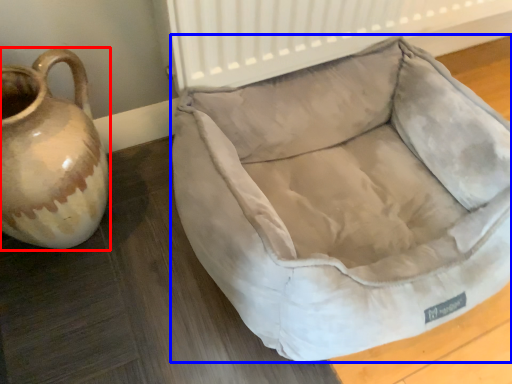
Question: Which object is further to the camera taking this photo, jug (highlighted by a red box) or dog bed (highlighted by a blue box)?

Choices:
 (A) jug
 (B) dog bed

Answer: (A)